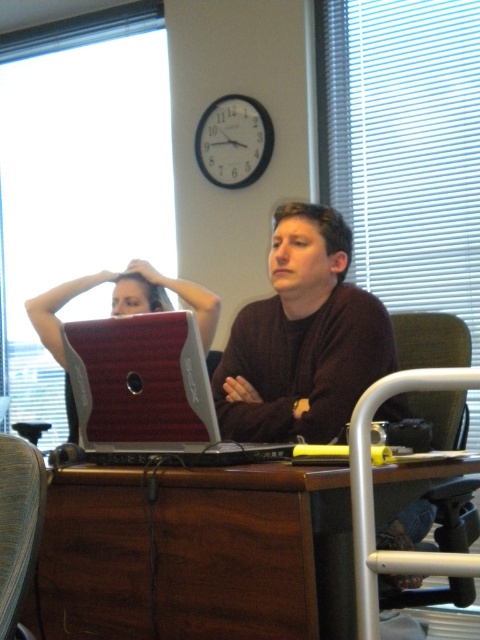
You are an office assistant who needs to locate the maroon textured laptop at center and the dark brown hair at upper center. Based on their positions, which object is closer to the left side of the desk?

The dark brown hair at upper center is closer to the left side of the desk because the maroon textured laptop at center is positioned to its right.

Looking at this image, you are an office assistant who needs to place a new keyboard on the desk. The keyboard requires 20 cm of space. Can the maroon textured laptop at center accommodate this requirement based on its width compared to the dark brown hair at upper center?

The maroon textured laptop at center is wider than the dark brown hair at upper center. Since the dark brown hair at upper center is likely part of the person on the left, the laptop has enough width to accommodate the 20 cm keyboard requirement.